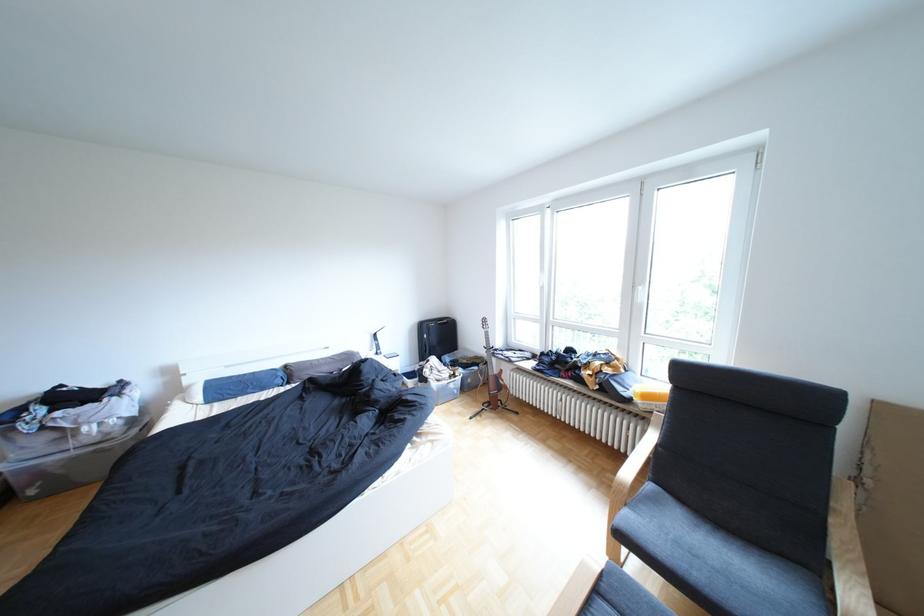
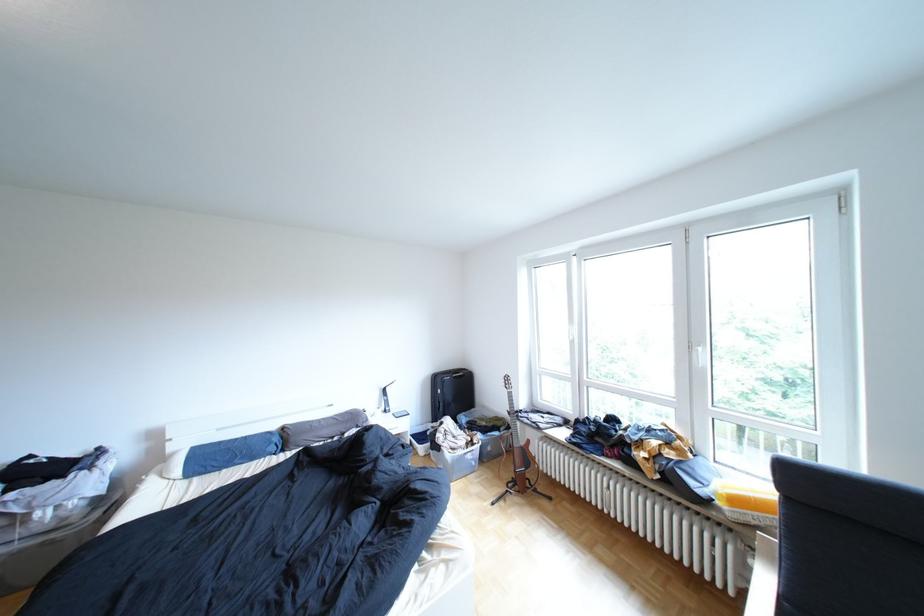
The point at (x=438, y=328) is marked in the first image. Where is the corresponding point in the second image?

(452, 379)